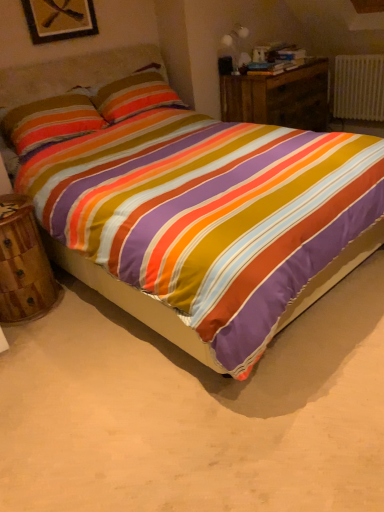
I want to click on unoccupied region to the right of wooden nightstand at lower left, the 1th nightstand in the bottom-to-top sequence, so click(x=77, y=307).